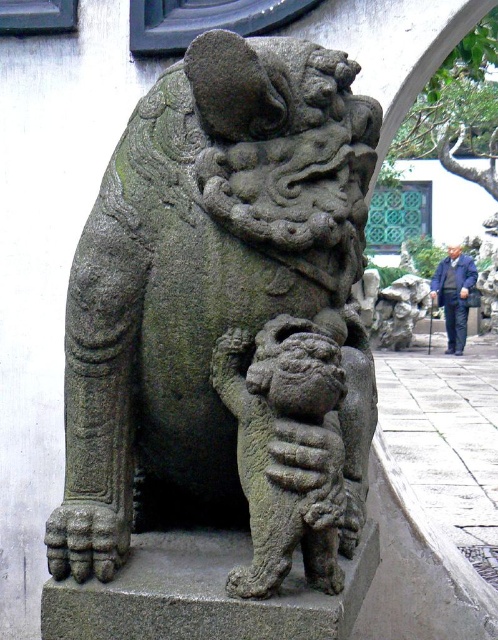
Question: Which point appears closest to the camera in this image?

Choices:
 (A) (249, 572)
 (B) (232, 316)

Answer: (A)

Question: Which object appears closest to the camera in this image?

Choices:
 (A) granite stone lion cub at lower center
 (B) gray stone lion at center

Answer: (A)

Question: Does gray stone lion at center have a lesser width compared to granite stone lion cub at lower center?

Choices:
 (A) yes
 (B) no

Answer: (B)

Question: Is gray stone lion at center thinner than granite stone lion cub at lower center?

Choices:
 (A) no
 (B) yes

Answer: (A)

Question: Is gray stone lion at center further to camera compared to granite stone lion cub at lower center?

Choices:
 (A) no
 (B) yes

Answer: (B)